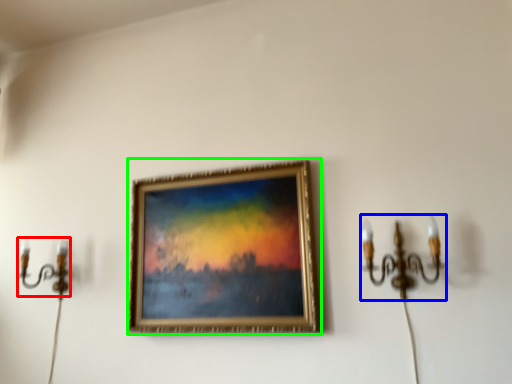
Question: Which object is the closest to the candle holder (highlighted by a red box)? Choose among these: candle holder (highlighted by a blue box) or picture frame (highlighted by a green box).

Choices:
 (A) candle holder
 (B) picture frame

Answer: (B)